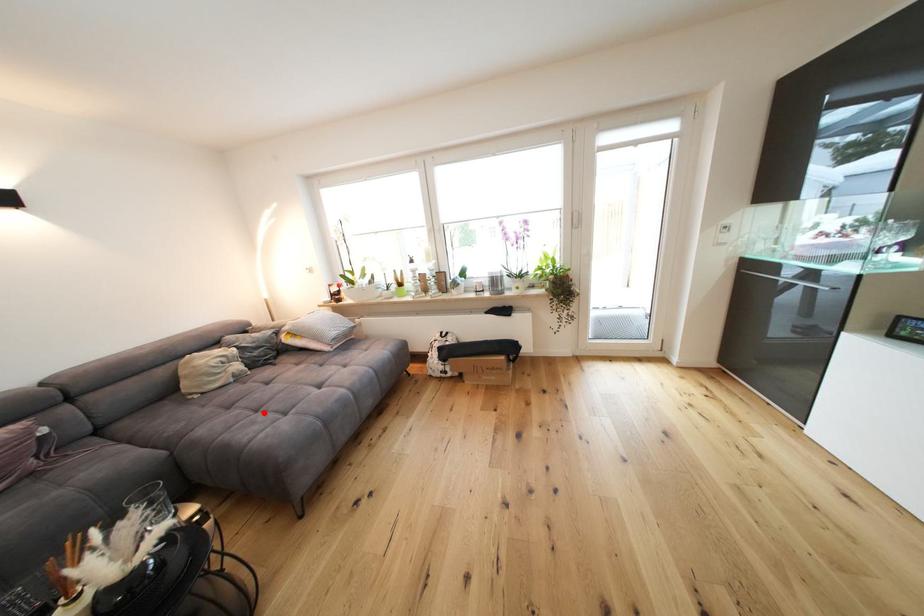
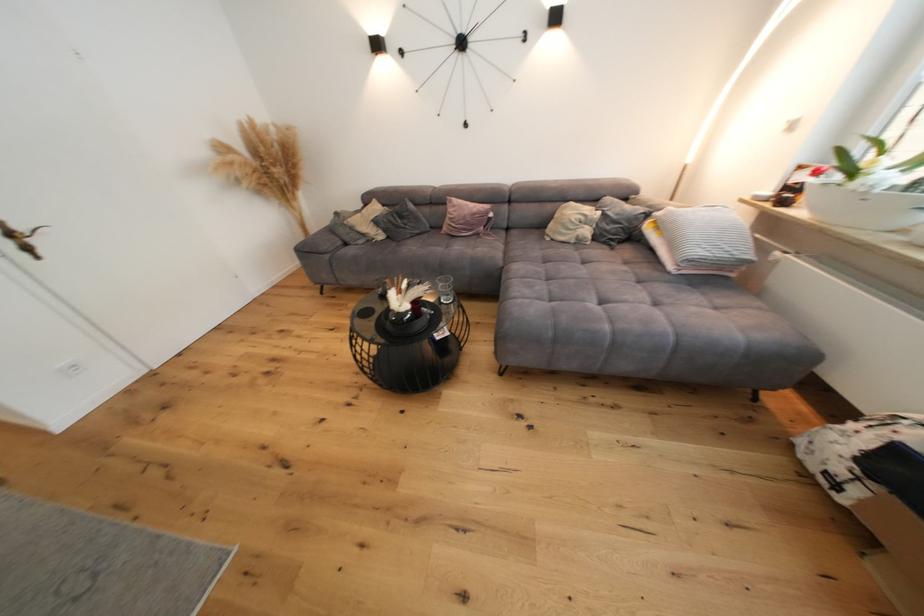
Locate, in the second image, the point that corresponds to the highlighted location in the first image.

(553, 282)